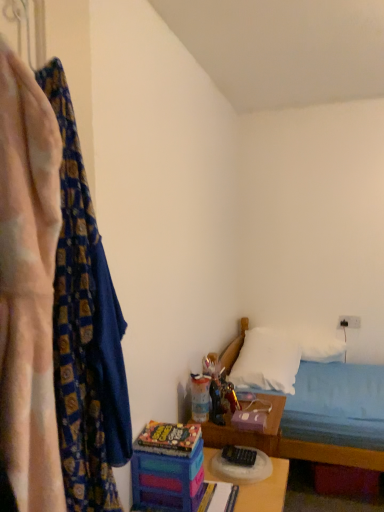
Question: Does multicolored plastic table at center have a larger size compared to white fabric bed at lower right?

Choices:
 (A) no
 (B) yes

Answer: (A)

Question: Does multicolored plastic table at center have a greater width compared to white fabric bed at lower right?

Choices:
 (A) yes
 (B) no

Answer: (B)

Question: Is the depth of multicolored plastic table at center greater than that of white fabric bed at lower right?

Choices:
 (A) no
 (B) yes

Answer: (A)

Question: Is multicolored plastic table at center far from white fabric bed at lower right?

Choices:
 (A) no
 (B) yes

Answer: (A)

Question: Is multicolored plastic table at center shorter than white fabric bed at lower right?

Choices:
 (A) yes
 (B) no

Answer: (A)

Question: Is multicolored plastic table at center not within white fabric bed at lower right?

Choices:
 (A) no
 (B) yes

Answer: (B)

Question: Is translucent plastic toy at center, positioned as the 2th toy in left-to-right order, touching white soft pillow at lower right, the 2th pillow in the back-to-front sequence?

Choices:
 (A) no
 (B) yes

Answer: (A)

Question: Is translucent plastic toy at center, the second toy in the front-to-back sequence, facing away from white soft pillow at lower right, the 2th pillow in the back-to-front sequence?

Choices:
 (A) no
 (B) yes

Answer: (A)

Question: From the image's perspective, is translucent plastic toy at center, marked as the first toy in a right-to-left arrangement, on white soft pillow at lower right, the 2th pillow in the back-to-front sequence?

Choices:
 (A) no
 (B) yes

Answer: (B)

Question: Is translucent plastic toy at center, positioned as the 2th toy in left-to-right order, positioned behind white soft pillow at lower right, the 1th pillow from the front?

Choices:
 (A) yes
 (B) no

Answer: (B)

Question: Is translucent plastic toy at center, positioned as the 2th toy in left-to-right order, to the left of white soft pillow at lower right, the 1th pillow from the front, from the viewer's perspective?

Choices:
 (A) no
 (B) yes

Answer: (B)

Question: Can you confirm if translucent plastic toy at center, marked as the first toy in a right-to-left arrangement, is positioned to the right of white soft pillow at lower right, the 2th pillow in the back-to-front sequence?

Choices:
 (A) no
 (B) yes

Answer: (A)

Question: From a real-world perspective, is translucent plastic toy at center, the second toy in the front-to-back sequence, below multicolored plastic toy at lower center, the 2th toy in the back-to-front sequence?

Choices:
 (A) yes
 (B) no

Answer: (B)